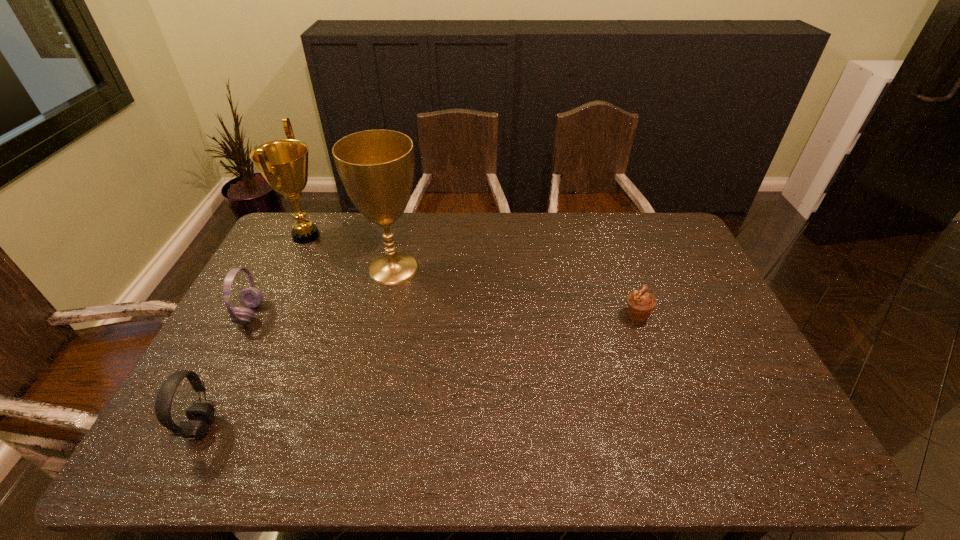
Identify the location of trophy cup. (376, 167).

The height and width of the screenshot is (540, 960). In order to click on award in this screenshot , I will do `click(283, 163)`.

Find the location of a particular element. The image size is (960, 540). the nearest object is located at coordinates (200, 415).

I want to click on the farther headset, so click(251, 297).

In order to click on the rightmost object in this screenshot , I will do `click(640, 303)`.

At what (x,y) coordinates should I click in order to perform the action: click on muffin. Please return your answer as a coordinate pair (x, y). Looking at the image, I should click on (640, 303).

Identify the location of free space located 0.130m on the right of the trophy cup. This screenshot has height=540, width=960. (464, 268).

At what (x,y) coordinates should I click in order to perform the action: click on vacant space located on the front view with handles of the award. Please return your answer as a coordinate pair (x, y). This screenshot has width=960, height=540. Looking at the image, I should click on (396, 236).

I want to click on vacant space located 0.070m on the front-facing side of the nearer headset, so click(x=243, y=427).

Where is `vacant area situated 0.220m on the headband and ear cups of the farther headset`? The image size is (960, 540). vacant area situated 0.220m on the headband and ear cups of the farther headset is located at coordinates (334, 314).